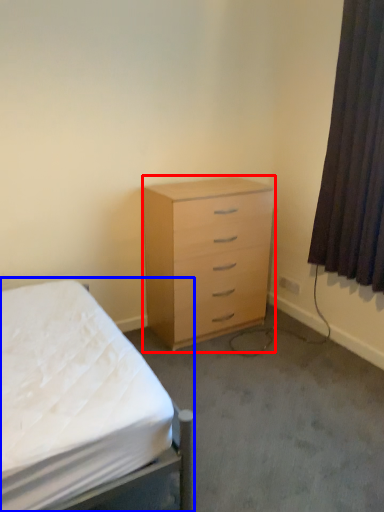
Question: Which of the following is the farthest to the observer, chest of drawers (highlighted by a red box) or bed (highlighted by a blue box)?

Choices:
 (A) chest of drawers
 (B) bed

Answer: (A)